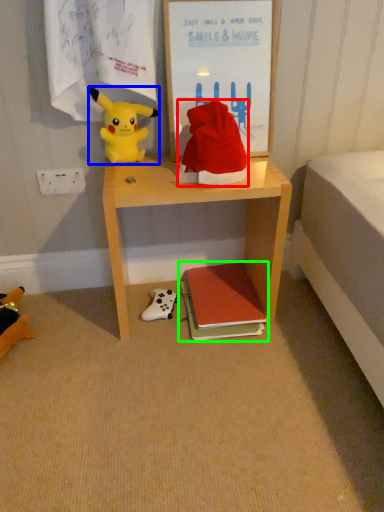
Question: Which is nearer to the hat (highlighted by a red box)? toy (highlighted by a blue box) or book (highlighted by a green box).

Choices:
 (A) toy
 (B) book

Answer: (A)